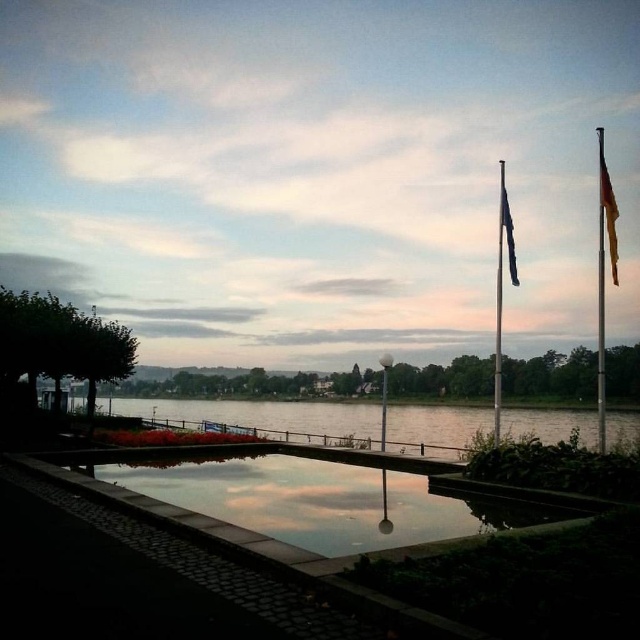
Which of these two, blue fabric flagpole at center or blue fabric flag at upper center, stands taller?

blue fabric flagpole at center

Does blue fabric flagpole at center appear over blue fabric flag at upper center?

No, blue fabric flagpole at center is not above blue fabric flag at upper center.

Which is in front, point (497, 310) or point (502, 195)?

Positioned in front is point (497, 310).

The width and height of the screenshot is (640, 640). In order to click on blue fabric flagpole at center in this screenshot , I will do `click(500, 291)`.

Which of these two, polished metal flag pole at right or blue fabric flagpole at center, stands shorter?

With less height is blue fabric flagpole at center.

This screenshot has width=640, height=640. What do you see at coordinates (604, 275) in the screenshot? I see `polished metal flag pole at right` at bounding box center [604, 275].

Image resolution: width=640 pixels, height=640 pixels. Identify the location of polished metal flag pole at right. (604, 275).

Can you confirm if polished metal flag pole at right is thinner than blue fabric flag at upper center?

Incorrect, polished metal flag pole at right's width is not less than blue fabric flag at upper center's.

Is point (598, 266) closer to camera compared to point (509, 218)?

No.

Locate an element on the screen. The image size is (640, 640). polished metal flag pole at right is located at coordinates click(604, 275).